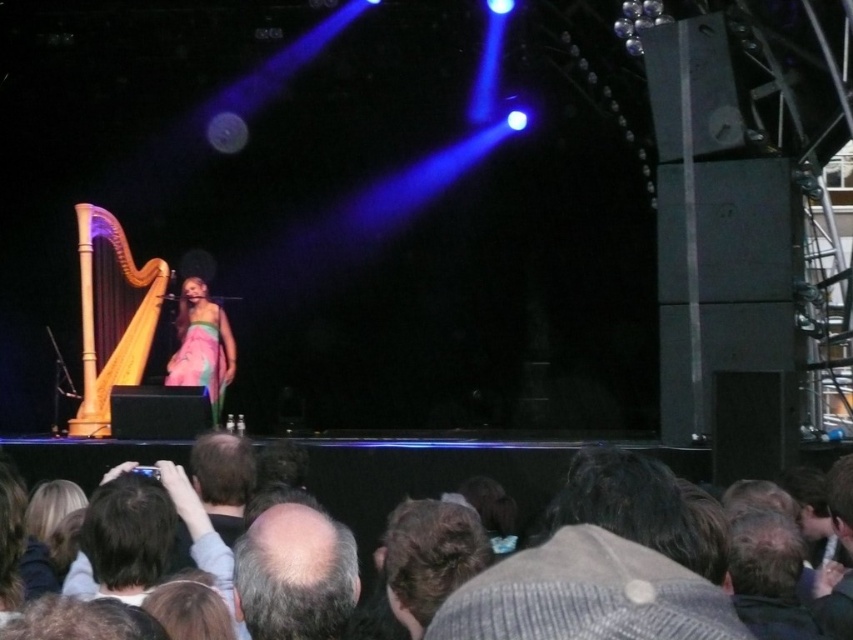
You are a photographer at the back of the audience. You want to take a photo of the bald head at center and the natural wood harp at left. Which object is narrower in the image?

The bald head at center is thinner than the natural wood harp at left, so the bald head at center is narrower in the image.

Looking at this image, you are a photographer at the back of the audience. You want to take a photo of the performer. The dark brown hair at lower center and the pastel silk dress at center are blocking your view. Which object is closer to you, making it the main obstruction?

The dark brown hair at lower center is closer to you than the pastel silk dress at center, so it is the main obstruction.